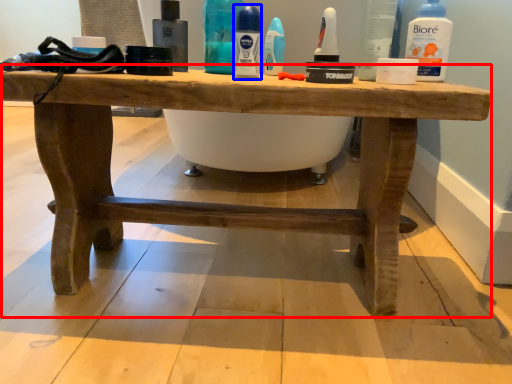
Question: Which point is closer to the camera, table (highlighted by a red box) or mouthwash (highlighted by a blue box)?

Choices:
 (A) table
 (B) mouthwash

Answer: (A)